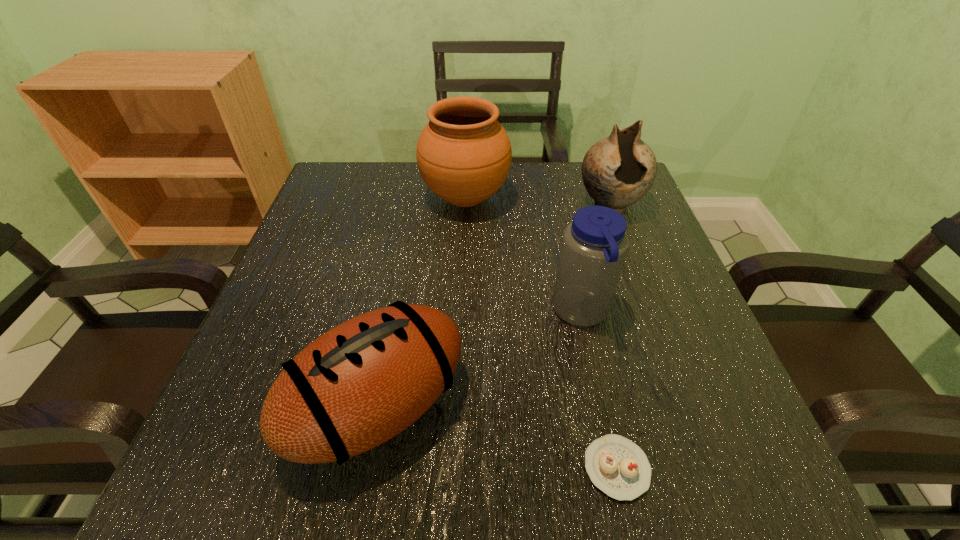
Locate an element on the screen. This screenshot has width=960, height=540. the left pottery is located at coordinates (464, 154).

Where is `the right pottery`? This screenshot has width=960, height=540. the right pottery is located at coordinates (617, 171).

This screenshot has width=960, height=540. I want to click on water bottle, so click(x=594, y=245).

Find the location of a particular element. The height and width of the screenshot is (540, 960). the second shortest object is located at coordinates (358, 385).

Find the location of a particular element. The height and width of the screenshot is (540, 960). the shortest object is located at coordinates (617, 466).

Locate an element on the screen. The image size is (960, 540). free space located on the right of the left pottery is located at coordinates (638, 198).

Locate an element on the screen. The width and height of the screenshot is (960, 540). vacant space located 0.280m from the spout of the right pottery is located at coordinates (651, 319).

Find the location of `vacant space located with a carrying loop on the side of the third farthest object`. vacant space located with a carrying loop on the side of the third farthest object is located at coordinates (414, 313).

Where is `free space located 0.100m with a carrying loop on the side of the third farthest object`? free space located 0.100m with a carrying loop on the side of the third farthest object is located at coordinates (499, 313).

Locate an element on the screen. This screenshot has width=960, height=540. vacant space located 0.280m with a carrying loop on the side of the third farthest object is located at coordinates (403, 313).